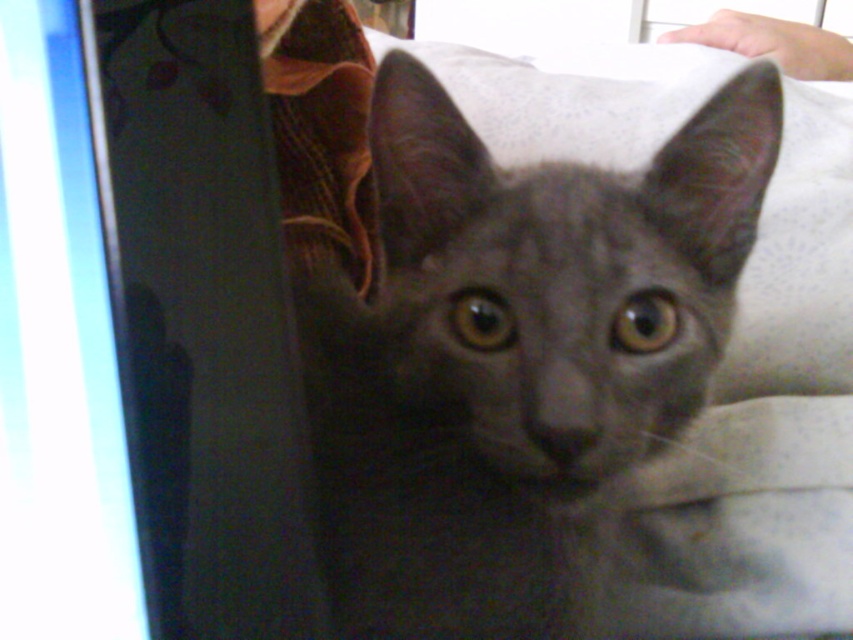
Based on the scene description, where is the gray matte fur cat at center located in terms of its 2D coordinates?

The gray matte fur cat at center is located at the 2D coordinates of point (514,353).

You are a photographer trying to capture the gray cat from the image. You notice two points in the scene at coordinates point (724,216) and point (41,141). Which point is closer to your camera lens?

Point (724,216) is further to the viewer than point (41,141), so the point closer to the camera lens is point (41,141).